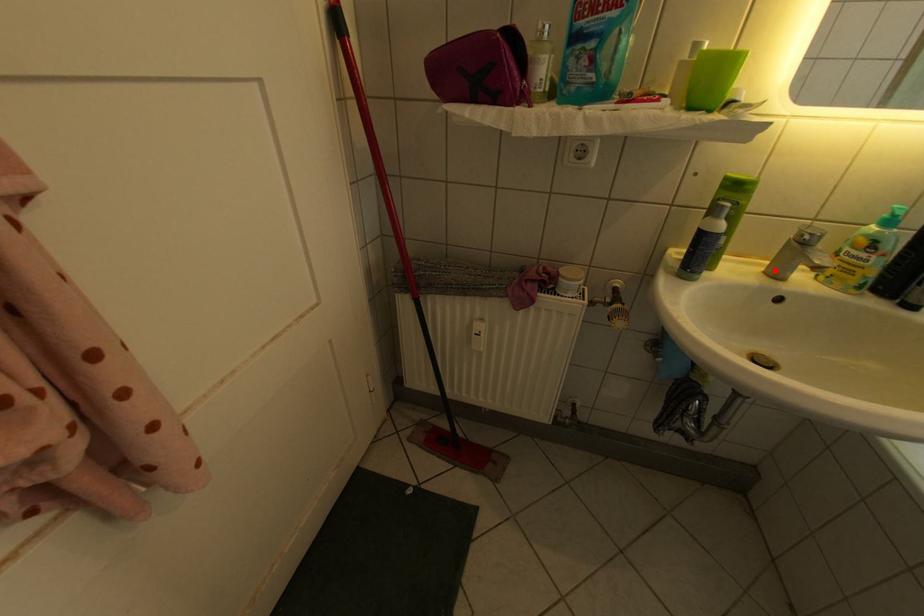
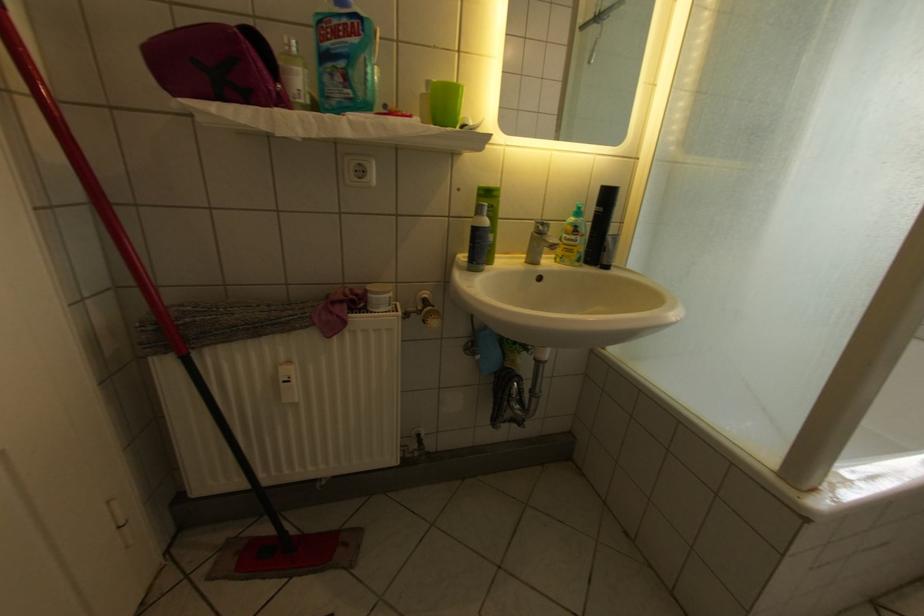
Find the pixel in the second image that matches the highlighted location in the first image.

(536, 262)